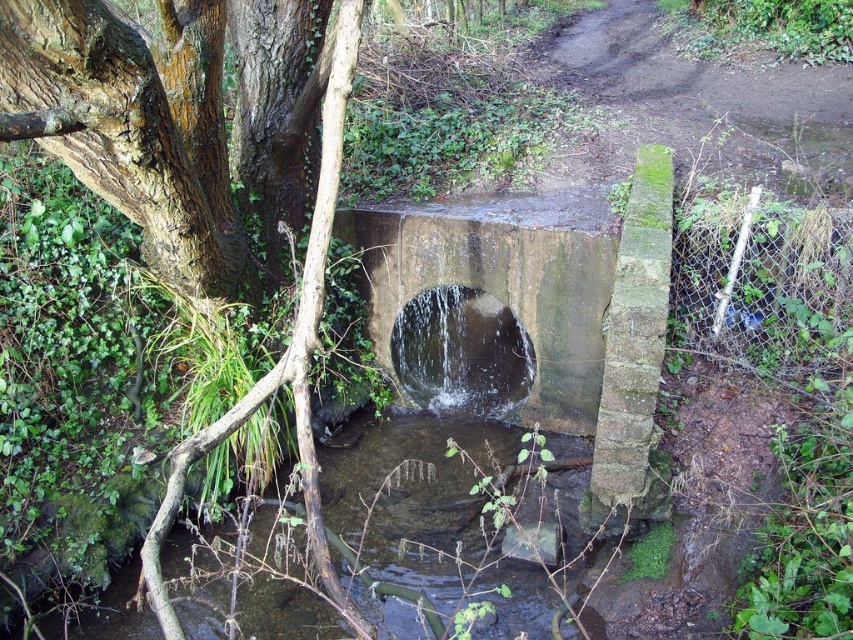
Which is behind, point (578, 433) or point (305, 611)?

The point (578, 433) is more distant.

Does concrete/rough concrete at center come in front of clear water at center?

That is False.

The height and width of the screenshot is (640, 853). Identify the location of concrete/rough concrete at center. (503, 280).

What are the coordinates of `concrete/rough concrete at center` in the screenshot? It's located at (503, 280).